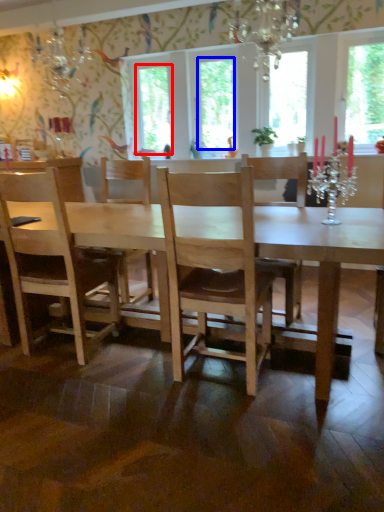
Question: Which object appears closest to the camera in this image, window screen (highlighted by a red box) or window screen (highlighted by a blue box)?

Choices:
 (A) window screen
 (B) window screen

Answer: (B)